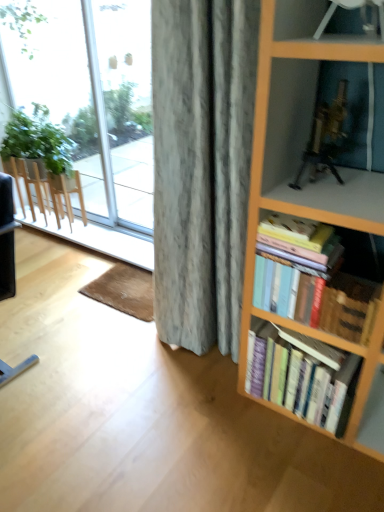
Where is `unoccupied area in front of hardcover books at right, acting as the 2th book starting from the top`? unoccupied area in front of hardcover books at right, acting as the 2th book starting from the top is located at coordinates (308, 462).